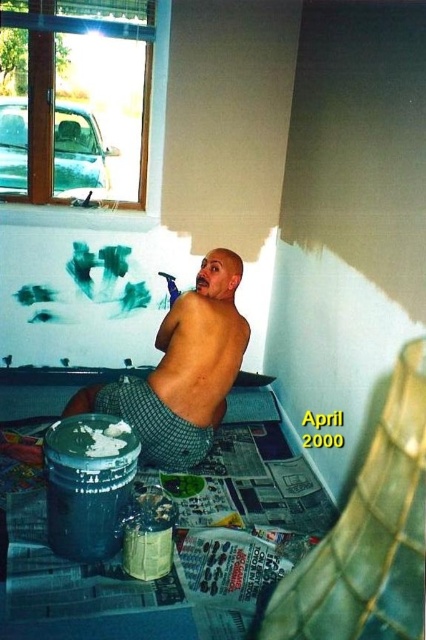
You are a contractor assessing the workspace safety. The shiny metallic paint can at lower left and muscular tan skin at back are both present. Which object is larger in size?

The shiny metallic paint can at lower left is bigger than muscular tan skin at back.

You are a contractor assessing the workspace. The shiny metallic paint can at lower left and the muscular tan skin at back are both in the way of the doorway. Which one should you move first to allow passage?

The shiny metallic paint can at lower left should be moved first because it is wider than the muscular tan skin at back, making it the larger obstruction.

You are a contractor assessing the workspace safety. The shiny metallic paint can at lower left and muscular tan skin at back are both in the work area. Which object is located to the left of the other?

The shiny metallic paint can at lower left is positioned on the left side of muscular tan skin at back.